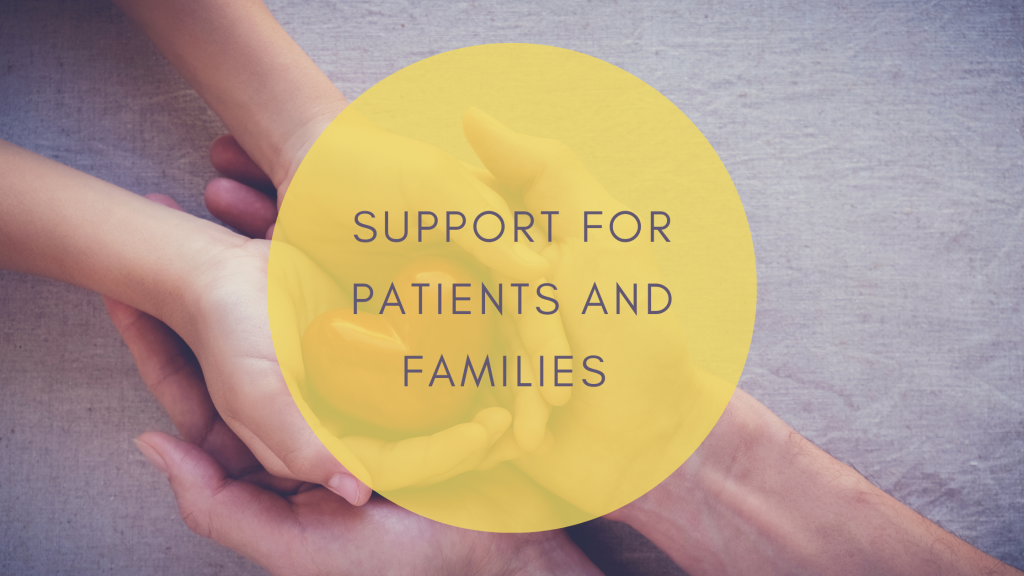
This screenshot has height=576, width=1024. I want to click on canvas, so click(754, 82).